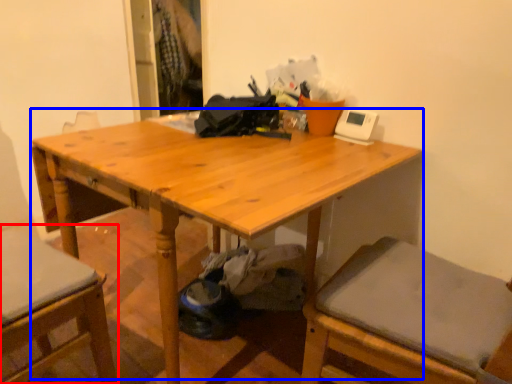
Question: Which of the following is the closest to the observer, chair (highlighted by a red box) or table (highlighted by a blue box)?

Choices:
 (A) chair
 (B) table

Answer: (A)